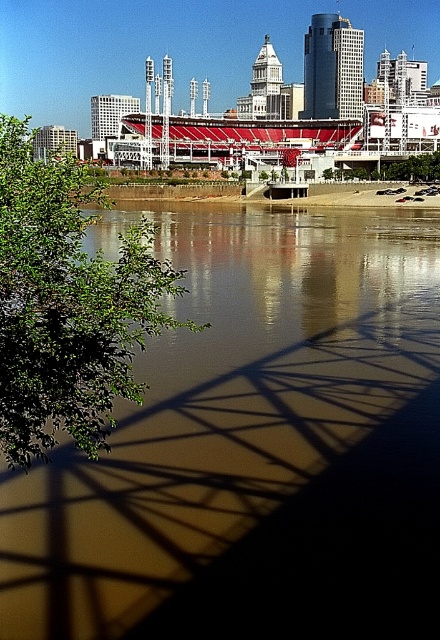
Question: Can you confirm if brown reflective water at center is thinner than green leafy tree at left?

Choices:
 (A) yes
 (B) no

Answer: (B)

Question: Does brown reflective water at center have a smaller size compared to green leafy tree at left?

Choices:
 (A) yes
 (B) no

Answer: (B)

Question: Among these objects, which one is nearest to the camera?

Choices:
 (A) brown reflective water at center
 (B) green leafy tree at left

Answer: (A)

Question: Is brown reflective water at center further to the viewer compared to green leafy tree at left?

Choices:
 (A) no
 (B) yes

Answer: (A)

Question: Which object appears farthest from the camera in this image?

Choices:
 (A) brown reflective water at center
 (B) green leafy tree at left

Answer: (B)

Question: Which object appears closest to the camera in this image?

Choices:
 (A) green leafy tree at left
 (B) brown reflective water at center

Answer: (B)